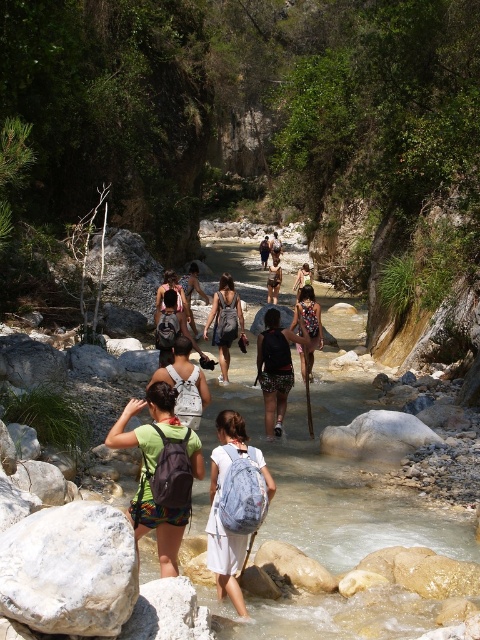
Can you confirm if clear water stream at center is bigger than denim skirt at center?

Yes.

Is clear water stream at center positioned behind denim skirt at center?

No, clear water stream at center is in front of denim skirt at center.

Does point (357, 528) lie behind point (217, 340)?

No.

The height and width of the screenshot is (640, 480). What are the coordinates of `clear water stream at center` in the screenshot? It's located at (328, 474).

Which of these two, white smooth rock at lower left or denim skirt at center, stands taller?

Standing taller between the two is denim skirt at center.

Which of these two, white smooth rock at lower left or denim skirt at center, stands shorter?

With less height is white smooth rock at lower left.

Which is behind, point (96, 593) or point (227, 321)?

The point (227, 321) is behind.

You are a GUI agent. You are given a task and a screenshot of the screen. Output one action in this format:
    pyautogui.click(x=<x>, y=<y>)
    Task: Click on the white smooth rock at lower left
    
    Given the screenshot: What is the action you would take?
    pyautogui.click(x=70, y=570)

Between point (6, 612) and point (191, 340), which one is positioned in front?

Point (6, 612) is more forward.

Identify the location of white smooth rock at lower left. (70, 570).

At what (x,y) coordinates should I click in order to perform the action: click on white smooth rock at lower left. Please return your answer as a coordinate pair (x, y). This screenshot has height=640, width=480. Looking at the image, I should click on (70, 570).